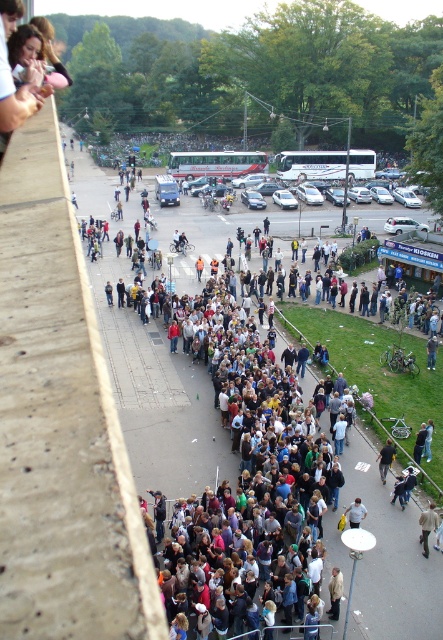
Question: Is dark blue jeans at lower center wider than light blue shirt at center?

Choices:
 (A) no
 (B) yes

Answer: (B)

Question: Can you confirm if dark gray concrete sidewalk at lower center is positioned above dark blue jeans at lower center?

Choices:
 (A) no
 (B) yes

Answer: (B)

Question: Which object is closer to the camera taking this photo?

Choices:
 (A) dark gray concrete sidewalk at lower center
 (B) dark blue jeans at lower center

Answer: (A)

Question: Which point is farther to the camera?

Choices:
 (A) light blue shirt at center
 (B) dark gray concrete sidewalk at lower center
 (C) dark blue jeans at lower center

Answer: (C)

Question: Which point is closer to the camera?

Choices:
 (A) (116, 259)
 (B) (349, 513)
 (C) (388, 444)

Answer: (B)

Question: Can you confirm if dark gray concrete sidewalk at lower center is bigger than light blue shirt at center?

Choices:
 (A) no
 (B) yes

Answer: (B)